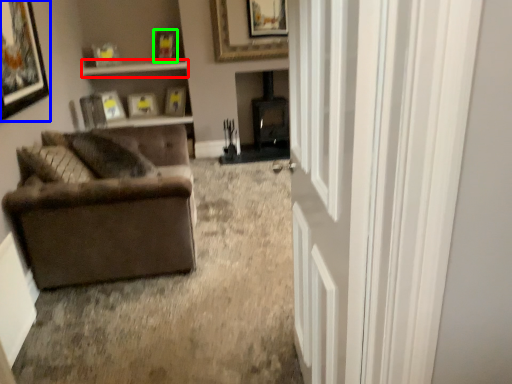
Question: Based on their relative distances, which object is farther from window sill (highlighted by a red box)? Choose from picture frame (highlighted by a blue box) and picture frame (highlighted by a green box).

Choices:
 (A) picture frame
 (B) picture frame

Answer: (A)